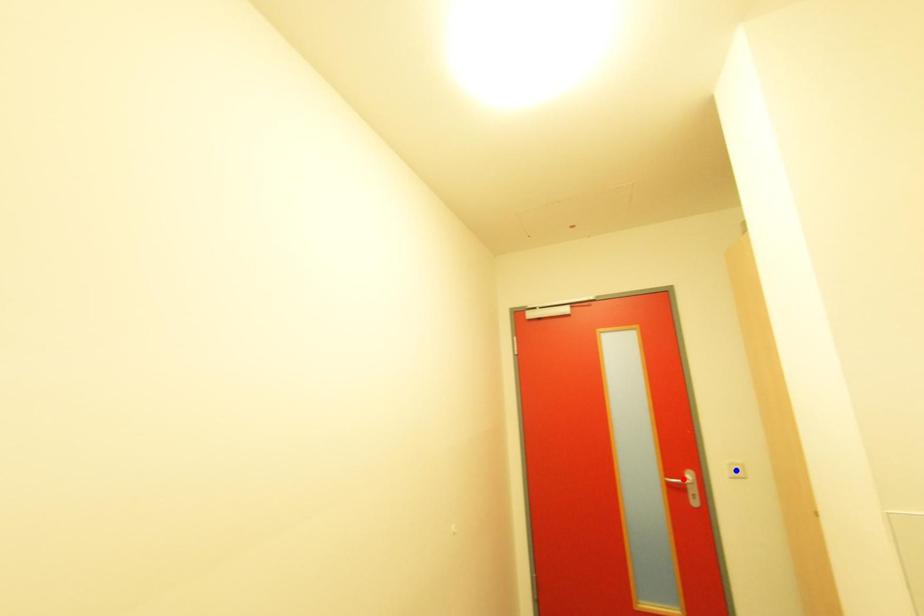
Question: Which of the two points in the image is closer to the camera?

Choices:
 (A) Blue point is closer.
 (B) Red point is closer.

Answer: (A)